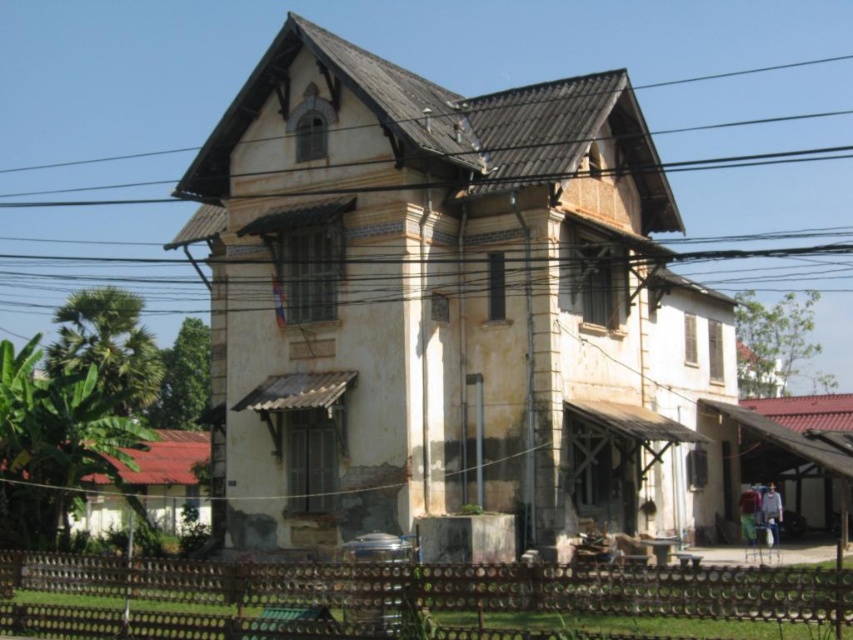
Can you confirm if brown wooden fence at lower center is smaller than brown wire at upper center?

Yes, brown wooden fence at lower center is smaller than brown wire at upper center.

Measure the distance between point (x=163, y=588) and camera.

The distance of point (x=163, y=588) from camera is 117.61 feet.

The height and width of the screenshot is (640, 853). I want to click on brown wooden fence at lower center, so click(x=415, y=600).